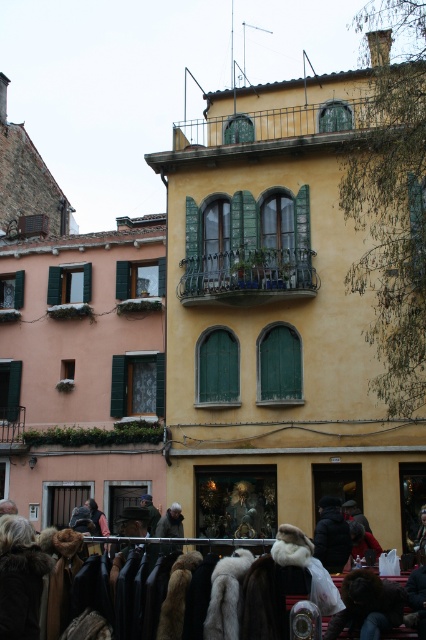
Who is lower down, fur coats at lower center or white fur coat at center?

fur coats at lower center is lower down.

Is point (146, 612) positioned after point (226, 609)?

Yes, point (146, 612) is farther from viewer.

At what (x,y) coordinates should I click in order to perform the action: click on fur coats at lower center. Please return your answer as a coordinate pair (x, y). Looking at the image, I should click on (108, 582).

What do you see at coordinates (227, 595) in the screenshot? The height and width of the screenshot is (640, 426). I see `white fur coat at center` at bounding box center [227, 595].

Can you confirm if white fur coat at center is bigger than brown furry coat at lower center?

Actually, white fur coat at center might be smaller than brown furry coat at lower center.

Is point (230, 572) positioned after point (172, 621)?

That is True.

Where is `white fur coat at center`? The image size is (426, 640). white fur coat at center is located at coordinates (227, 595).

Find the location of `fur coats at lower center`. fur coats at lower center is located at coordinates (108, 582).

Where is `fur coats at lower center`? This screenshot has width=426, height=640. fur coats at lower center is located at coordinates (108, 582).